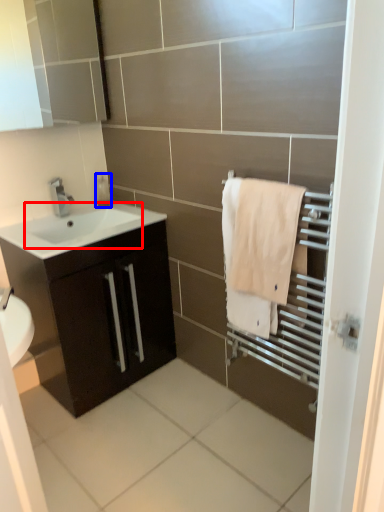
Question: Which point is further to the camera, sink (highlighted by a red box) or soap dispenser (highlighted by a blue box)?

Choices:
 (A) sink
 (B) soap dispenser

Answer: (B)